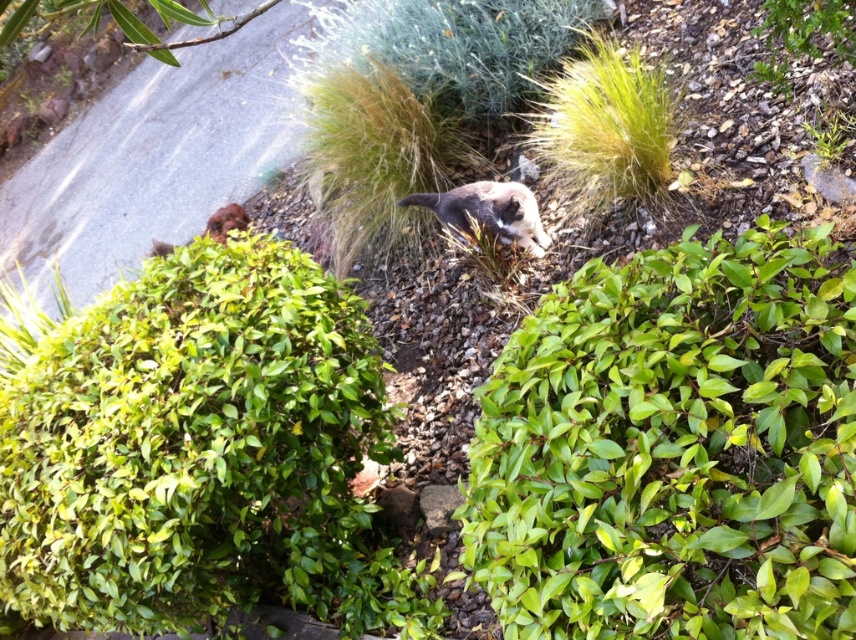
You are standing at the origin point in the image. You want to walk to the green leafy shrub at center. In which direction should you move relative to your current position?

The green leafy shrub at center is located at coordinates 0.702 on the x axis and 0.789 on the y axis. Since you are at the origin point, you should move towards the positive x and positive y directions to reach it.

You are standing at the origin point of the image. Where is the green leafy hedge at center located in terms of coordinates?

The green leafy hedge at center is located at coordinates point (201, 452).